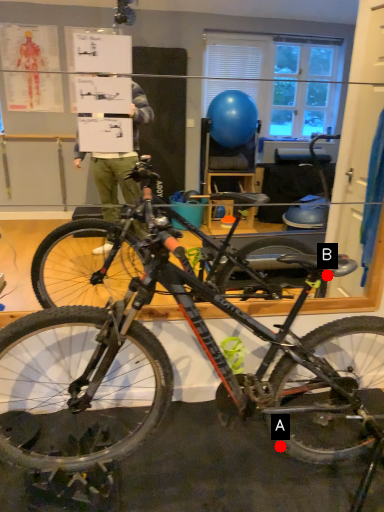
Question: Two points are circled on the image, labeled by A and B beside each circle. Which point appears farthest from the camera in this image?

Choices:
 (A) A is further
 (B) B is further

Answer: (B)